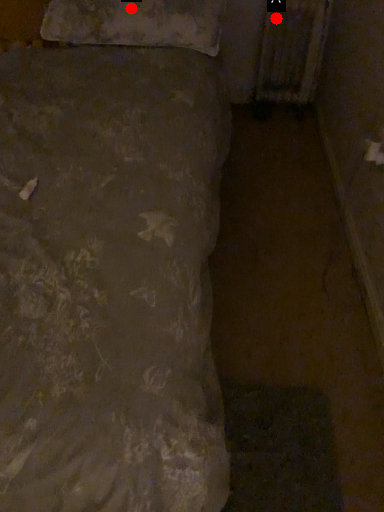
Question: Two points are circled on the image, labeled by A and B beside each circle. Which point appears closest to the camera in this image?

Choices:
 (A) A is closer
 (B) B is closer

Answer: (B)